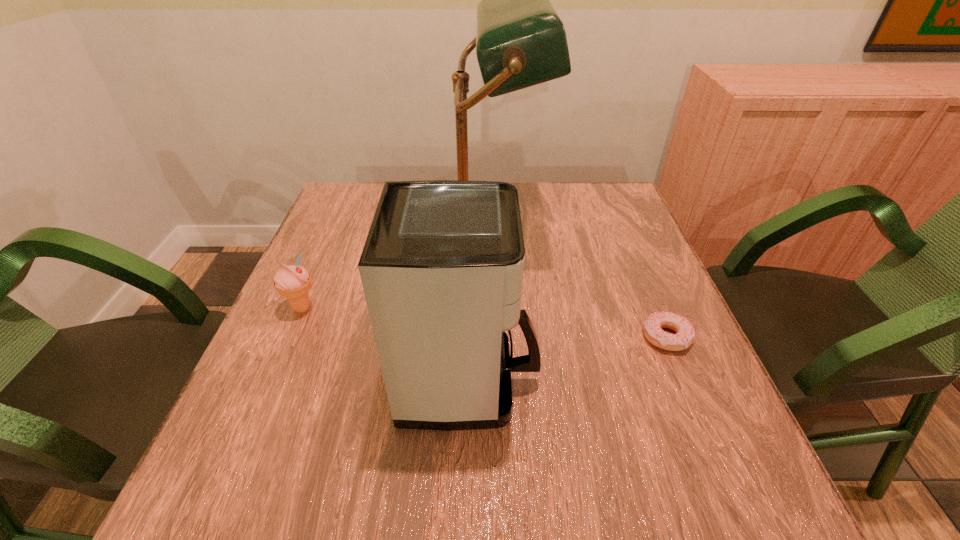
You are a GUI agent. You are given a task and a screenshot of the screen. Output one action in this format:
    pyautogui.click(x=<x>, y=<y>)
    Task: Click on the vacant space located on the front of the doughnut
    
    Given the screenshot: What is the action you would take?
    pyautogui.click(x=732, y=491)

Locate an element on the screen. object that is at the far edge is located at coordinates (520, 41).

Identify the location of object situated at the left edge. (292, 282).

Locate an element on the screen. The height and width of the screenshot is (540, 960). object situated at the right edge is located at coordinates (653, 325).

In the image, there is a desktop. In order to click on vacant space at the far edge in this screenshot , I will do `click(535, 193)`.

This screenshot has width=960, height=540. What are the coordinates of `vacant point at the near edge` in the screenshot? It's located at (x=370, y=492).

You are a GUI agent. You are given a task and a screenshot of the screen. Output one action in this format:
    pyautogui.click(x=<x>, y=<y>)
    Task: Click on the free region at the left edge of the desktop
    The height and width of the screenshot is (540, 960).
    Given the screenshot: What is the action you would take?
    pyautogui.click(x=317, y=264)

You are a GUI agent. You are given a task and a screenshot of the screen. Output one action in this format:
    pyautogui.click(x=<x>, y=<y>)
    Task: Click on the free space at the right edge
    This screenshot has width=960, height=540.
    Given the screenshot: What is the action you would take?
    pyautogui.click(x=643, y=243)

At what (x,y) coordinates should I click in order to perform the action: click on free point at the far left corner. Please return your answer as a coordinate pair (x, y). The image size is (960, 540). Looking at the image, I should click on (x=364, y=207).

The width and height of the screenshot is (960, 540). What are the coordinates of `vacant space at the far right corner` in the screenshot? It's located at (588, 213).